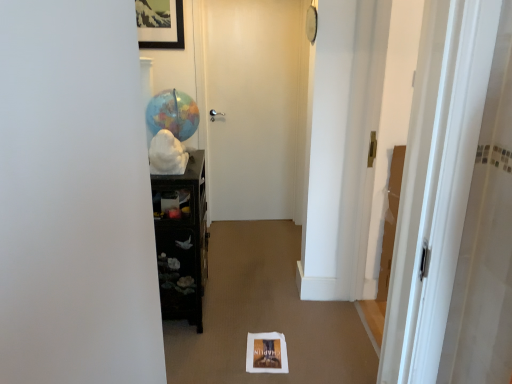
Locate an element on the screen. This screenshot has height=384, width=512. black glossy cabinet at left is located at coordinates (182, 241).

What do you see at coordinates (255, 107) in the screenshot?
I see `white matte door at center, which appears as the 1th door when viewed from the back` at bounding box center [255, 107].

Measure the distance between white matte door at center, marked as the first door in a left-to-right arrangement, and camera.

10.50 feet.

Describe the element at coordinates (160, 24) in the screenshot. I see `wooden framed picture at upper center` at that location.

Where is `black glossy cabinet at left`? Image resolution: width=512 pixels, height=384 pixels. black glossy cabinet at left is located at coordinates (182, 241).

Which point is more forward, [161,305] or [150,6]?

The point [161,305] is closer.

Is black glossy cabinet at left thinner than wooden framed picture at upper center?

Incorrect, the width of black glossy cabinet at left is not less than that of wooden framed picture at upper center.

Considering the sizes of objects black glossy cabinet at left and wooden framed picture at upper center in the image provided, who is smaller, black glossy cabinet at left or wooden framed picture at upper center?

wooden framed picture at upper center is smaller.

Considering the relative positions of black glossy cabinet at left and wooden framed picture at upper center in the image provided, is black glossy cabinet at left to the right of wooden framed picture at upper center from the viewer's perspective?

Yes, black glossy cabinet at left is to the right of wooden framed picture at upper center.

Which object is wider, white glossy door at right, the first door viewed from the front, or wooden framed picture at upper center?

With larger width is white glossy door at right, the first door viewed from the front.

Where is `door in front of the wooden framed picture at upper center`? door in front of the wooden framed picture at upper center is located at coordinates (436, 182).

From the image's perspective, which object appears higher, white glossy door at right, which ranks as the 1th door in right-to-left order, or wooden framed picture at upper center?

From the image's view, wooden framed picture at upper center is above.

Is white glossy door at right, the second door from the left, not within wooden framed picture at upper center?

white glossy door at right, the second door from the left, lies outside wooden framed picture at upper center's area.

In terms of height, does matte globe at center look taller or shorter compared to white matte door at center, which is the second door in front-to-back order?

Clearly, matte globe at center is shorter compared to white matte door at center, which is the second door in front-to-back order.

Which object is positioned more to the right, matte globe at center or white matte door at center, the second door when ordered from right to left?

white matte door at center, the second door when ordered from right to left.

How much distance is there between matte globe at center and white matte door at center, marked as the first door in a left-to-right arrangement?

matte globe at center is 1.22 meters from white matte door at center, marked as the first door in a left-to-right arrangement.

This screenshot has height=384, width=512. In order to click on balloon in front of the white matte door at center, which appears as the 1th door when viewed from the back in this screenshot , I will do `click(173, 114)`.

Considering the positions of objects black glossy cabinet at left and white glossy door at right, which ranks as the 1th door in right-to-left order, in the image provided, who is more to the right, black glossy cabinet at left or white glossy door at right, which ranks as the 1th door in right-to-left order,?

white glossy door at right, which ranks as the 1th door in right-to-left order.

Where is `furniture on the left of white glossy door at right, the first door viewed from the front`? furniture on the left of white glossy door at right, the first door viewed from the front is located at coordinates (182, 241).

Is black glossy cabinet at left oriented away from white glossy door at right, the first door viewed from the front?

black glossy cabinet at left is not turned away from white glossy door at right, the first door viewed from the front.

From the image's perspective, who appears lower, black glossy cabinet at left or white glossy door at right, the 2th door when ordered from back to front?

From the image's view, black glossy cabinet at left is below.

Is white matte door at center, which is the second door in front-to-back order, aimed at wooden framed picture at upper center?

No, white matte door at center, which is the second door in front-to-back order, does not turn towards wooden framed picture at upper center.

Considering the relative sizes of white matte door at center, which appears as the 1th door when viewed from the back, and wooden framed picture at upper center in the image provided, is white matte door at center, which appears as the 1th door when viewed from the back, thinner than wooden framed picture at upper center?

Indeed, white matte door at center, which appears as the 1th door when viewed from the back, has a lesser width compared to wooden framed picture at upper center.

Is point (291, 55) positioned after point (144, 17)?

Yes, point (291, 55) is behind point (144, 17).

From a real-world perspective, between white matte door at center, the second door when ordered from right to left, and wooden framed picture at upper center, who is vertically higher?

In real-world perspective, wooden framed picture at upper center is above.

In the image, there is a wooden framed picture at upper center. In order to click on furniture below it (from a real-world perspective) in this screenshot , I will do `click(182, 241)`.

Is wooden framed picture at upper center next to black glossy cabinet at left?

wooden framed picture at upper center and black glossy cabinet at left are not in contact.

From the image's perspective, does wooden framed picture at upper center appear higher than black glossy cabinet at left?

Yes, from the image's perspective, wooden framed picture at upper center is above black glossy cabinet at left.

Can black glossy cabinet at left be found inside white glossy door at right, which ranks as the 1th door in right-to-left order?

Definitely not — black glossy cabinet at left is not inside white glossy door at right, which ranks as the 1th door in right-to-left order.

Which is closer to the camera, (x=425, y=174) or (x=160, y=229)?

The point (x=425, y=174) is closer.

Which of these two, white glossy door at right, the second door from the left, or black glossy cabinet at left, stands taller?

white glossy door at right, the second door from the left.

Where is `picture frame lying on the left of black glossy cabinet at left`? picture frame lying on the left of black glossy cabinet at left is located at coordinates (160, 24).

The image size is (512, 384). In order to click on picture frame above the white glossy door at right, the second door from the left (from a real-world perspective) in this screenshot , I will do `click(160, 24)`.

In the scene shown: Which object lies further to the anchor point black glossy cabinet at left, white glossy door at right, the 2th door when ordered from back to front, or matte globe at center?

The object further to black glossy cabinet at left is white glossy door at right, the 2th door when ordered from back to front.

From the image, which object appears to be nearer to matte globe at center, white matte door at center, the second door when ordered from right to left, or wooden framed picture at upper center?

wooden framed picture at upper center is positioned closer to the anchor matte globe at center.

Looking at the image, which one is located closer to matte globe at center, white glossy door at right, the 2th door when ordered from back to front, or white matte door at center, the second door when ordered from right to left?

Among the two, white matte door at center, the second door when ordered from right to left, is located nearer to matte globe at center.

Which object lies further to the anchor point matte globe at center, wooden framed picture at upper center or white matte door at center, which is the second door in front-to-back order?

Based on the image, white matte door at center, which is the second door in front-to-back order, appears to be further to matte globe at center.

From the image, which object appears to be nearer to matte globe at center, black glossy cabinet at left or white matte door at center, the second door when ordered from right to left?

black glossy cabinet at left is closer to matte globe at center.

From the image, which object appears to be nearer to white matte door at center, which appears as the 1th door when viewed from the back, matte globe at center or white glossy door at right, the 2th door when ordered from back to front?

Based on the image, matte globe at center appears to be nearer to white matte door at center, which appears as the 1th door when viewed from the back.

Considering their positions, is white matte door at center, which appears as the 1th door when viewed from the back, positioned closer to black glossy cabinet at left than matte globe at center?

matte globe at center is positioned closer to the anchor black glossy cabinet at left.

In the scene shown: From the image, which object appears to be nearer to white glossy door at right, the 2th door when ordered from back to front, black glossy cabinet at left or wooden framed picture at upper center?

black glossy cabinet at left lies closer to white glossy door at right, the 2th door when ordered from back to front, than the other object.

This screenshot has height=384, width=512. I want to click on picture frame between white glossy door at right, the 2th door when ordered from back to front, and white matte door at center, which appears as the 1th door when viewed from the back, along the z-axis, so click(x=160, y=24).

Locate an element on the screen. This screenshot has height=384, width=512. furniture between white glossy door at right, the 2th door when ordered from back to front, and wooden framed picture at upper center, along the z-axis is located at coordinates (182, 241).

Locate an element on the screen. This screenshot has height=384, width=512. picture frame located between matte globe at center and white matte door at center, the second door when ordered from right to left, in the depth direction is located at coordinates (160, 24).

Locate an element on the screen. The height and width of the screenshot is (384, 512). balloon between white glossy door at right, the first door viewed from the front, and white matte door at center, the second door when ordered from right to left, along the z-axis is located at coordinates 173,114.